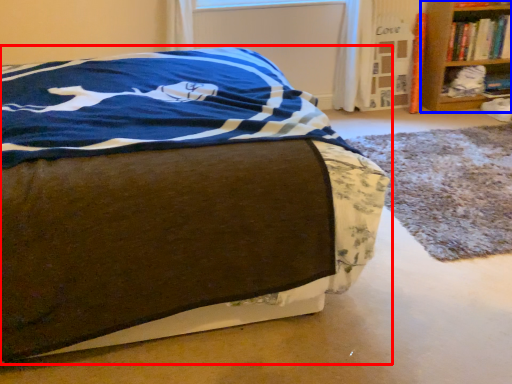
Question: Among these objects, which one is farthest to the camera, bed (highlighted by a red box) or shelf (highlighted by a blue box)?

Choices:
 (A) bed
 (B) shelf

Answer: (B)